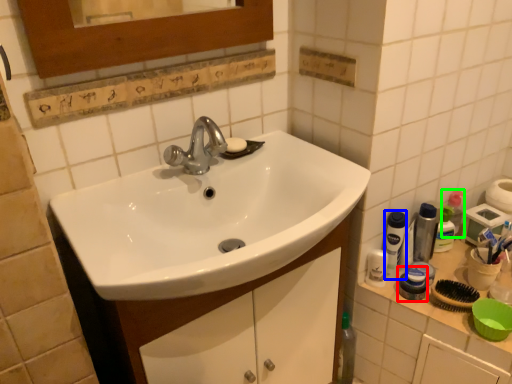
Question: Which object is the closest to the mouthwash (highlighted by a red box)? Choose among these: mouthwash (highlighted by a blue box) or mouthwash (highlighted by a green box).

Choices:
 (A) mouthwash
 (B) mouthwash

Answer: (A)